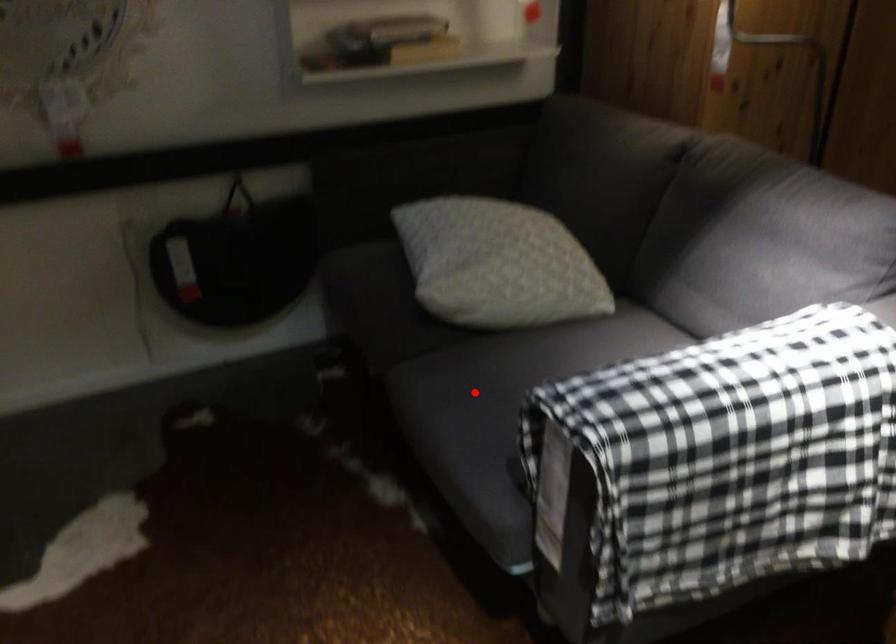
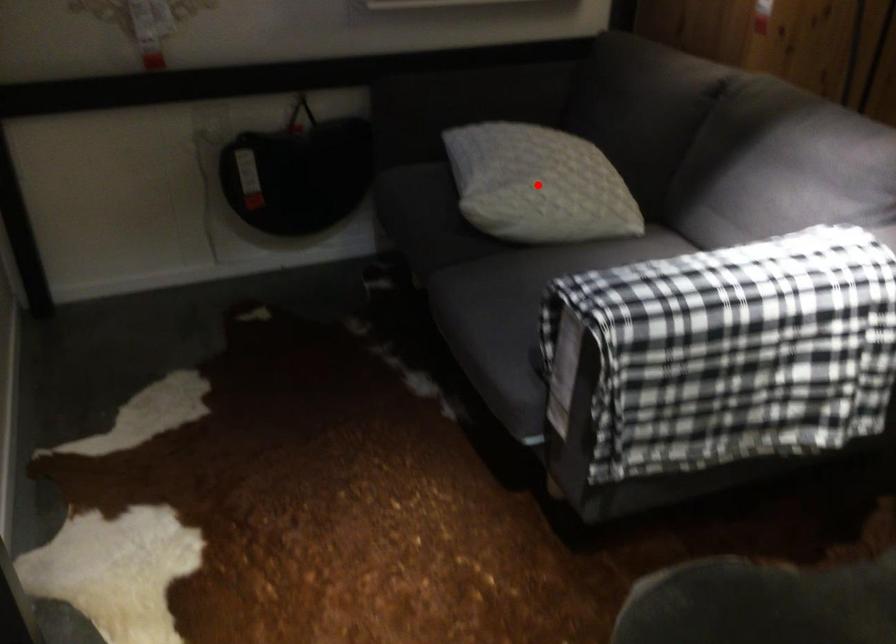
I am providing you with two images of the same scene from different viewpoints. A red point is marked on the first image and another point is marked on the second image. Is the red point in image1 aligned with the point shown in image2?

No